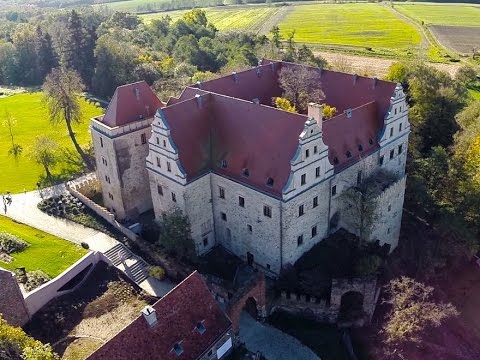
This screenshot has height=360, width=480. I want to click on stairs, so click(x=137, y=268).